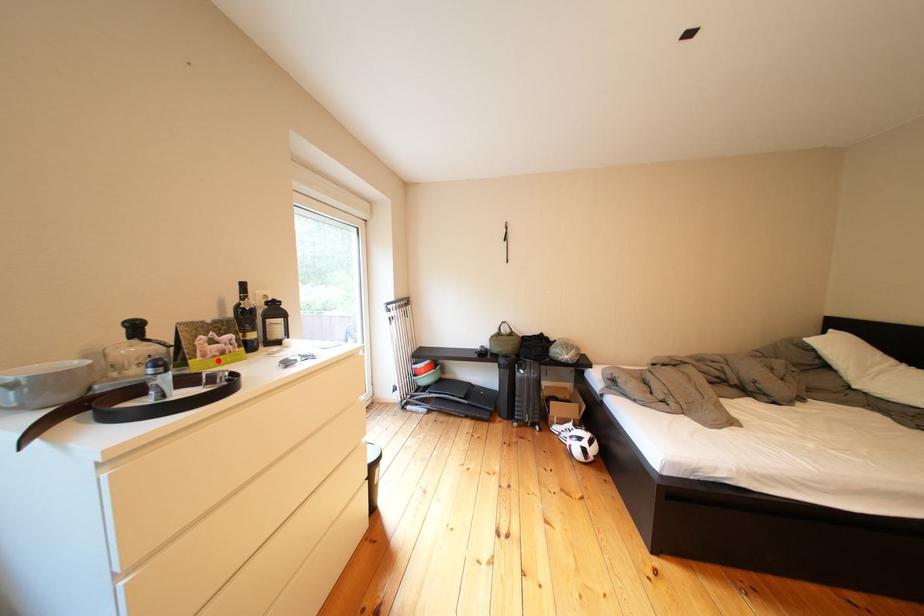
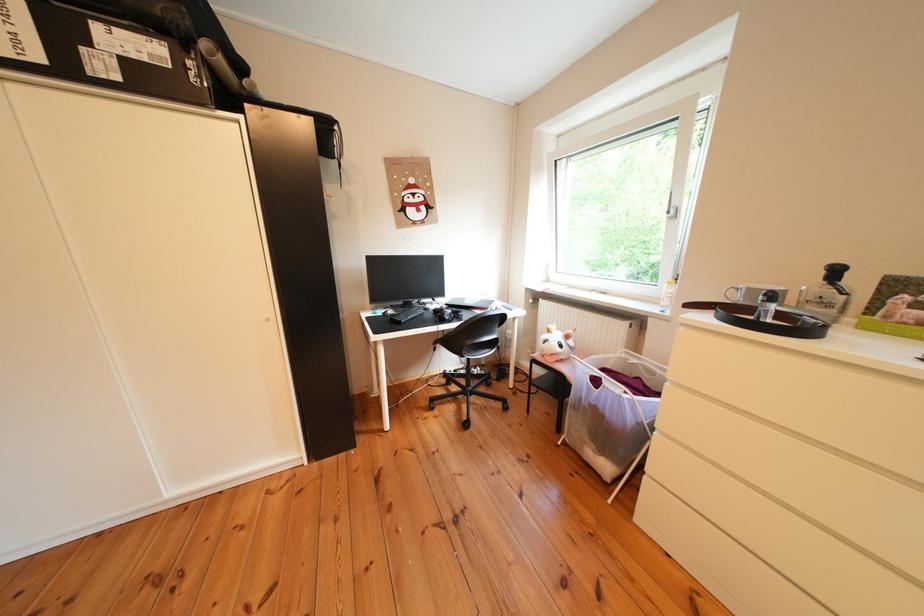
Where in the second image is the point corresponding to the highlighted location from the first image?

(901, 322)